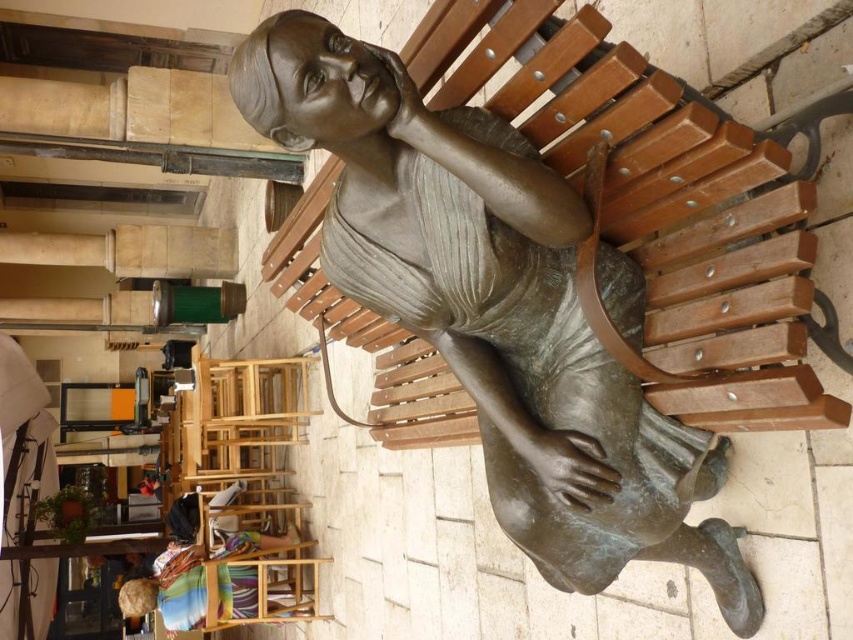
Is bronze statue at center thinner than multicolored fabric at lower left?

Yes, bronze statue at center is thinner than multicolored fabric at lower left.

Is bronze statue at center smaller than multicolored fabric at lower left?

No, bronze statue at center is not smaller than multicolored fabric at lower left.

Which is behind, point (515, 180) or point (228, 600)?

The point (228, 600) is behind.

Where is `bronze statue at center`? bronze statue at center is located at coordinates (494, 308).